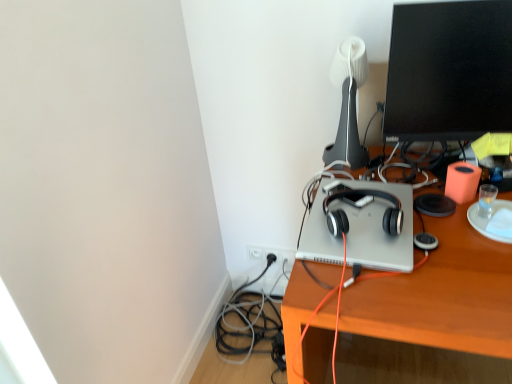
Question: Is satin black headphones at center positioned with its back to silver metallic laptop at center?

Choices:
 (A) yes
 (B) no

Answer: (B)

Question: Is there a large distance between satin black headphones at center and silver metallic laptop at center?

Choices:
 (A) no
 (B) yes

Answer: (A)

Question: Is satin black headphones at center shorter than silver metallic laptop at center?

Choices:
 (A) no
 (B) yes

Answer: (A)

Question: Considering the relative sizes of satin black headphones at center and silver metallic laptop at center in the image provided, is satin black headphones at center smaller than silver metallic laptop at center?

Choices:
 (A) no
 (B) yes

Answer: (B)

Question: From the image's perspective, does satin black headphones at center appear lower than silver metallic laptop at center?

Choices:
 (A) no
 (B) yes

Answer: (A)

Question: Considering the relative sizes of satin black headphones at center and silver metallic laptop at center in the image provided, is satin black headphones at center thinner than silver metallic laptop at center?

Choices:
 (A) yes
 (B) no

Answer: (A)

Question: Is satin black headphones at center at the right side of black glossy monitor at upper right?

Choices:
 (A) no
 (B) yes

Answer: (A)

Question: Does satin black headphones at center have a greater width compared to black glossy monitor at upper right?

Choices:
 (A) yes
 (B) no

Answer: (A)

Question: From the image's perspective, is satin black headphones at center located beneath black glossy monitor at upper right?

Choices:
 (A) no
 (B) yes

Answer: (B)

Question: Is satin black headphones at center taller than black glossy monitor at upper right?

Choices:
 (A) no
 (B) yes

Answer: (A)

Question: Does satin black headphones at center come in front of black glossy monitor at upper right?

Choices:
 (A) no
 (B) yes

Answer: (A)

Question: Is satin black headphones at center thinner than black glossy monitor at upper right?

Choices:
 (A) yes
 (B) no

Answer: (B)

Question: Does white matte table lamp at upper center touch satin black headphones at center?

Choices:
 (A) yes
 (B) no

Answer: (B)